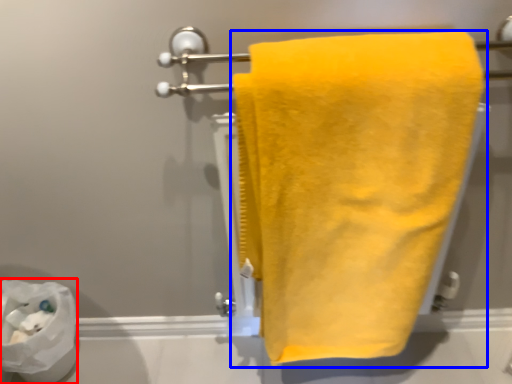
Question: Which object is further to the camera taking this photo, toilet paper (highlighted by a red box) or towel (highlighted by a blue box)?

Choices:
 (A) toilet paper
 (B) towel

Answer: (A)